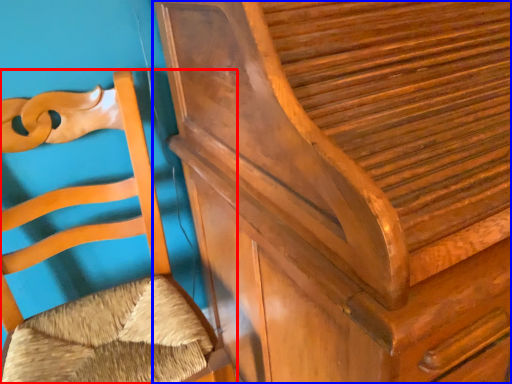
Question: Among these objects, which one is farthest to the camera, furniture (highlighted by a red box) or furniture (highlighted by a blue box)?

Choices:
 (A) furniture
 (B) furniture

Answer: (A)